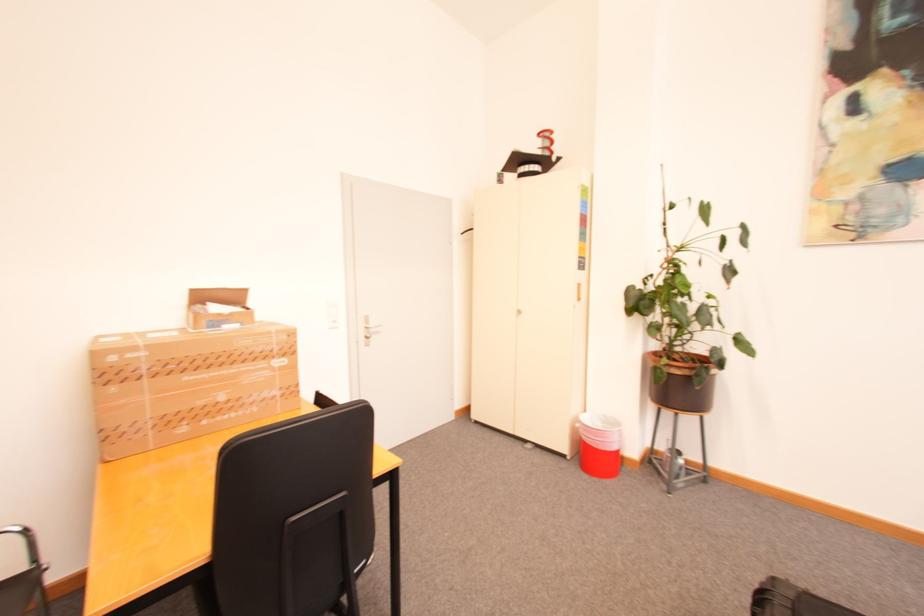
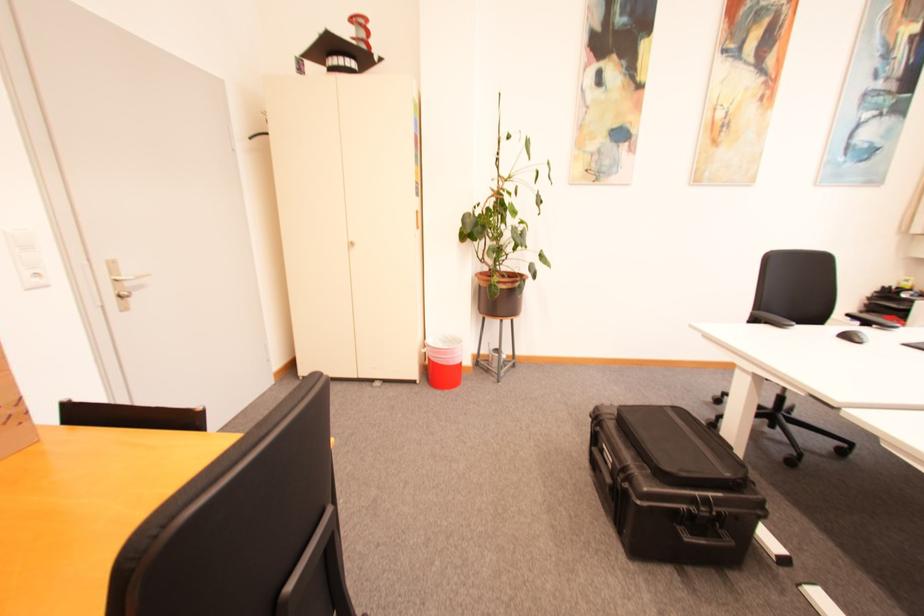
In the second image, find the point that corresponds to [664,371] in the first image.

(500, 286)